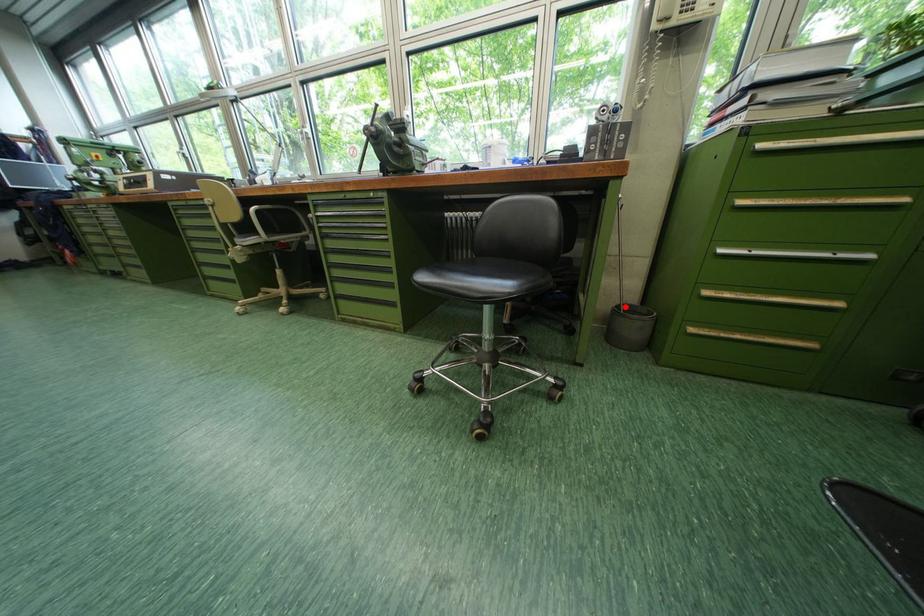
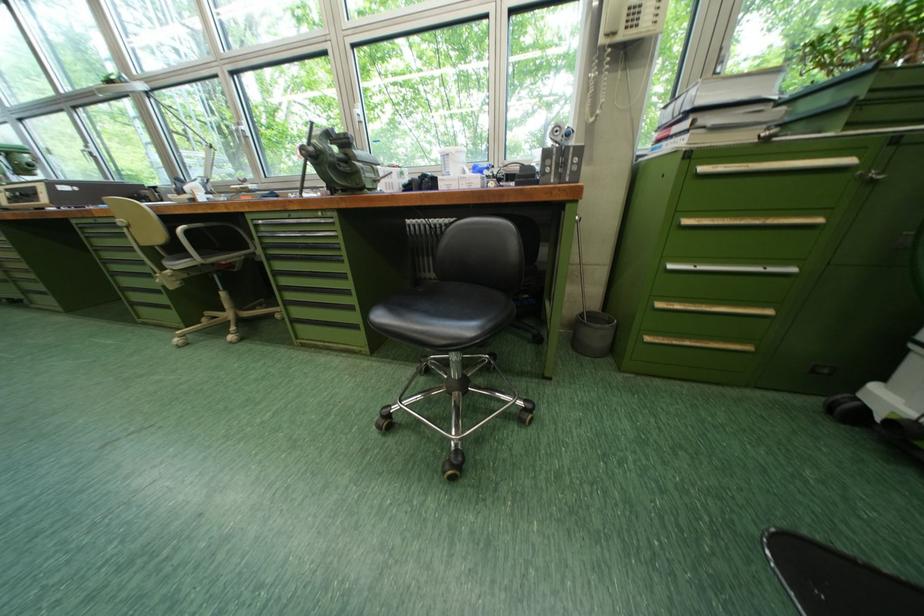
In the second image, find the point that corresponds to the highlighted location in the first image.

(589, 315)